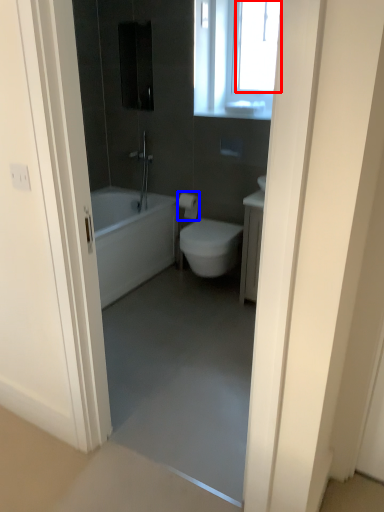
Question: Which object appears farthest to the camera in this image, window screen (highlighted by a red box) or toilet paper (highlighted by a blue box)?

Choices:
 (A) window screen
 (B) toilet paper

Answer: (B)